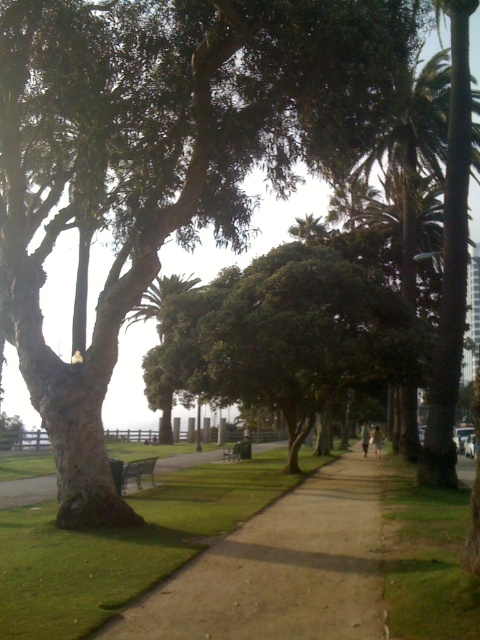
You are a gardener who needs to walk along the brown dirt path at center while avoiding the green leafy palm tree at center. Can you walk through the path without touching the tree?

The brown dirt path at center has a lesser width compared to green leafy palm tree at center, so the path is narrower than the tree. This means the path may not be wide enough to walk through without potentially touching the tree, especially if the tree branches extend over the path.

Based on the photo, you are planning to walk along the brown dirt path at center and sit on the wooden park bench at center. Which one is bigger in size?

The brown dirt path at center has a larger size compared to the wooden park bench at center.